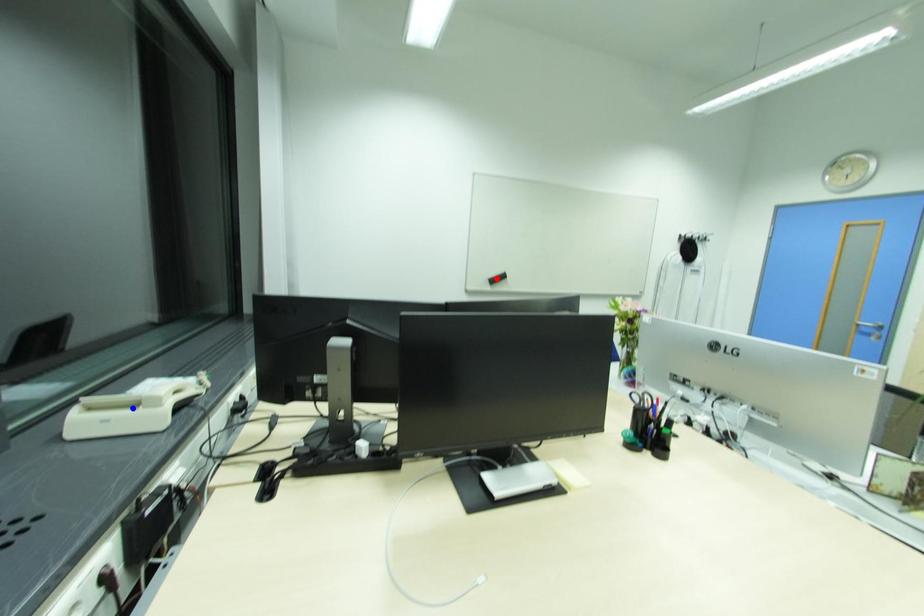
Question: In the image, two points are highlighted. Which point is nearer to the camera? Reply with the corresponding letter.

Choices:
 (A) blue point
 (B) red point

Answer: (A)